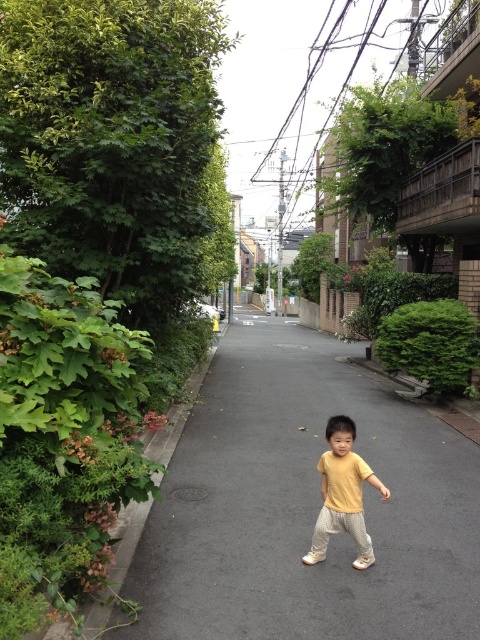
You are a pedestrian standing on the black asphalt pavement at center and want to reach the yellow matte shirt at center. Which direction should you move to get there?

The yellow matte shirt at center is to the left of the black asphalt pavement at center, so you should move to the left to reach it.